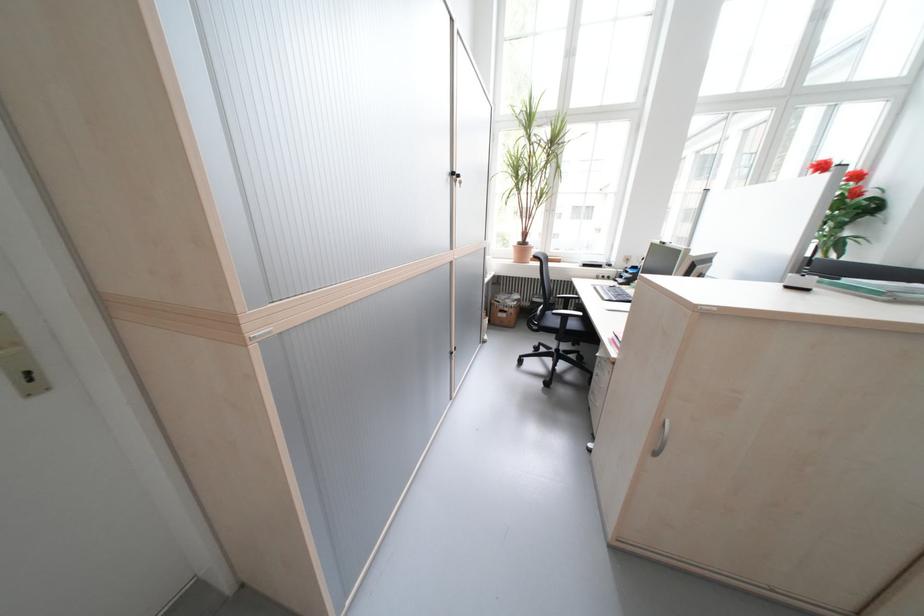
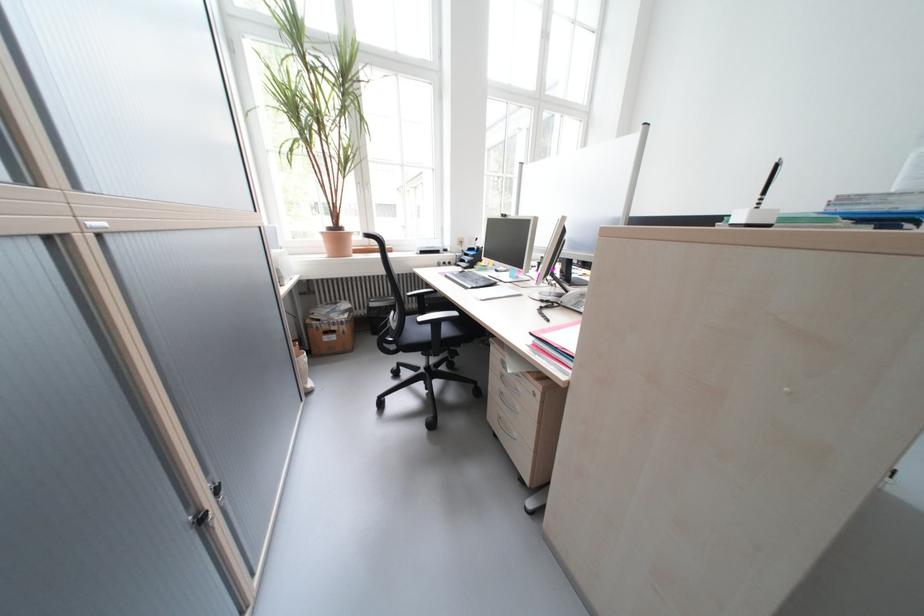
Locate, in the second image, the point that corresponds to point 462,354 in the first image.

(213, 521)